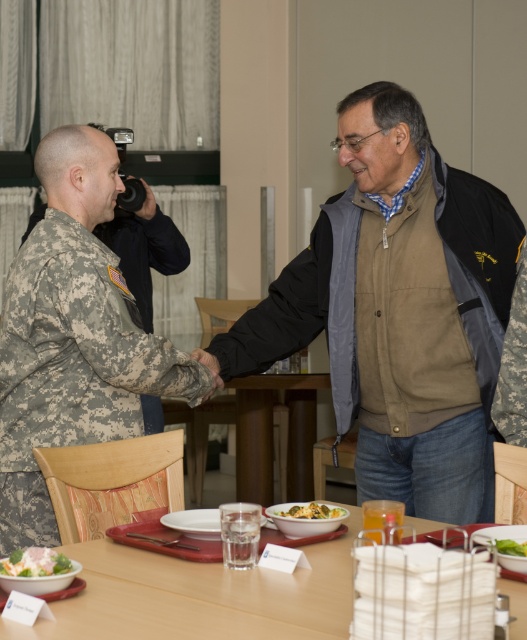
Between camouflage fabric uniform at left and wooden table at lower center, which one is positioned higher?

camouflage fabric uniform at left

Between point (26, 353) and point (173, 600), which one is positioned in front?

Point (173, 600) is in front.

What are the coordinates of `camouflage fabric uniform at left` in the screenshot? It's located at (72, 365).

Who is shorter, camouflage fabric uniform at left or yellowish matte pasta at center?

yellowish matte pasta at center is shorter.

At what (x,y) coordinates should I click in order to perform the action: click on camouflage fabric uniform at left. Please return your answer as a coordinate pair (x, y). Looking at the image, I should click on (72, 365).

At what (x,y) coordinates should I click in order to perform the action: click on camouflage fabric uniform at left. Please return your answer as a coordinate pair (x, y). Looking at the image, I should click on (72, 365).

The width and height of the screenshot is (527, 640). I want to click on camouflage fabric uniform at left, so click(x=72, y=365).

Does wooden table at lower center appear over green leafy salad at lower center?

No, wooden table at lower center is not above green leafy salad at lower center.

Between point (119, 625) and point (506, 552), which one is positioned in front?

Positioned in front is point (119, 625).

Locate an element on the screen. wooden table at lower center is located at coordinates (200, 596).